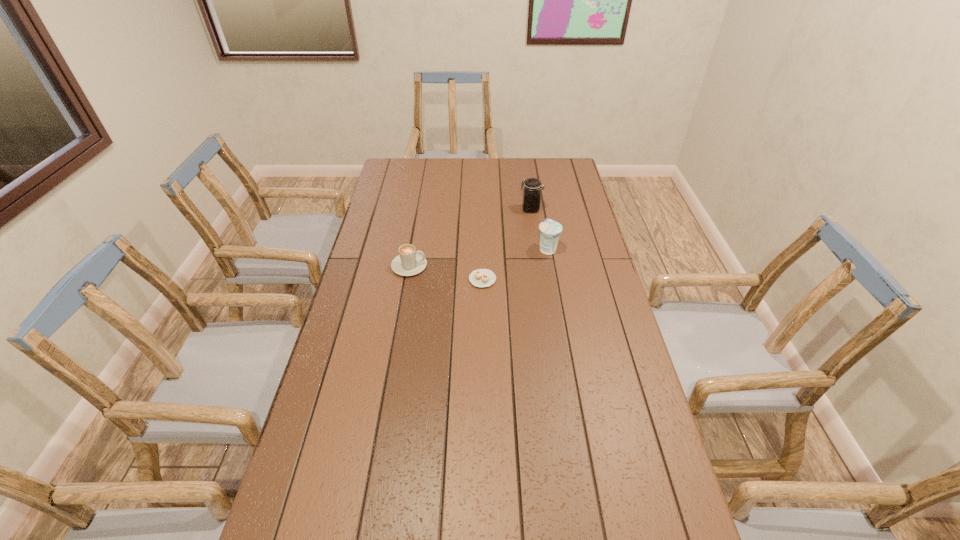
Identify the location of the tallest object. This screenshot has height=540, width=960. (531, 198).

Find the location of `jar`. jar is located at coordinates (531, 198).

Find the location of a particular element. This screenshot has width=960, height=540. the second tallest object is located at coordinates (550, 230).

Identify the location of the third tallest object. The image size is (960, 540). (409, 262).

The image size is (960, 540). In order to click on cappuccino in this screenshot , I will do `click(409, 262)`.

Find the location of `the third object from right to left`. the third object from right to left is located at coordinates (481, 277).

At what (x,y) coordinates should I click in order to perform the action: click on the shortest object. Please return your answer as a coordinate pair (x, y). This screenshot has width=960, height=540. Looking at the image, I should click on (481, 277).

This screenshot has width=960, height=540. Find the location of `free space located on the lid of the jar`. free space located on the lid of the jar is located at coordinates tap(445, 209).

Image resolution: width=960 pixels, height=540 pixels. In order to click on blank space located 0.340m on the lid of the jar in this screenshot , I will do `click(439, 209)`.

At what (x,y) coordinates should I click in order to perform the action: click on free space located on the lid of the jar. Please return your answer as a coordinate pair (x, y). The width and height of the screenshot is (960, 540). Looking at the image, I should click on (481, 209).